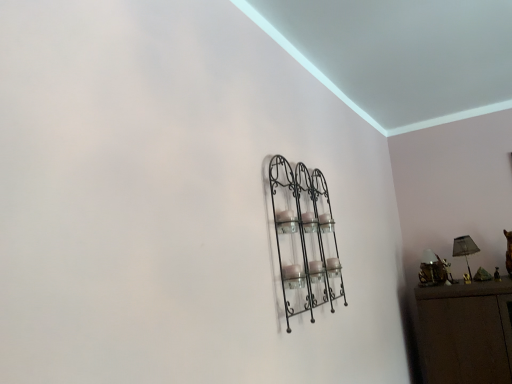
What do you see at coordinates (430, 269) in the screenshot? I see `metallic gold lamp at right` at bounding box center [430, 269].

The height and width of the screenshot is (384, 512). Find the location of `black wrought iron shelf at center`. black wrought iron shelf at center is located at coordinates [304, 238].

You are a GUI agent. You are given a task and a screenshot of the screen. Output one action in this format:
    pyautogui.click(x=<x>, y=<y>)
    Task: Click on the metallic gold lamp at right
    This screenshot has width=512, height=384.
    Given the screenshot: What is the action you would take?
    pyautogui.click(x=430, y=269)

Which is behind, black wrought iron shelf at center or metallic gold lamp at right?

metallic gold lamp at right is further from the camera.

In the scene shown: Is there a large distance between black wrought iron shelf at center and metallic gold lamp at right?

Yes, black wrought iron shelf at center is far from metallic gold lamp at right.

Does black wrought iron shelf at center have a greater height compared to metallic gold lamp at right?

Yes.

Between matte black lampshade at right and black wrought iron shelf at center, which one has smaller size?

Smaller between the two is matte black lampshade at right.

Is matte black lampshade at right to the left of black wrought iron shelf at center from the viewer's perspective?

In fact, matte black lampshade at right is to the right of black wrought iron shelf at center.

Is matte black lampshade at right not inside black wrought iron shelf at center?

Yes.

Image resolution: width=512 pixels, height=384 pixels. In order to click on shelf on the left of matte black lampshade at right in this screenshot , I will do `click(304, 238)`.

From the picture: Is matte black lampshade at right in contact with metallic gold lamp at right?

matte black lampshade at right and metallic gold lamp at right are clearly separated.

From the image's perspective, is matte black lampshade at right over metallic gold lamp at right?

Correct, matte black lampshade at right appears higher than metallic gold lamp at right in the image.

Does matte black lampshade at right lie behind metallic gold lamp at right?

No, it is not.

Considering the relative sizes of black wrought iron shelf at center and matte black lampshade at right in the image provided, is black wrought iron shelf at center shorter than matte black lampshade at right?

No, black wrought iron shelf at center is not shorter than matte black lampshade at right.

Between black wrought iron shelf at center and matte black lampshade at right, which one appears on the right side from the viewer's perspective?

matte black lampshade at right.

Is black wrought iron shelf at center facing towards matte black lampshade at right?

No.

Which point is more forward, (312, 279) or (458, 248)?

The point (312, 279) is more forward.

Considering the relative sizes of metallic gold lamp at right and black wrought iron shelf at center in the image provided, is metallic gold lamp at right shorter than black wrought iron shelf at center?

Indeed, metallic gold lamp at right has a lesser height compared to black wrought iron shelf at center.

From the picture: Which is more to the right, metallic gold lamp at right or black wrought iron shelf at center?

metallic gold lamp at right is more to the right.

From a real-world perspective, does metallic gold lamp at right sit lower than black wrought iron shelf at center?

Yes, from a real-world perspective, metallic gold lamp at right is under black wrought iron shelf at center.

From the image's perspective, does metallic gold lamp at right appear lower than black wrought iron shelf at center?

Yes, from the image's perspective, metallic gold lamp at right is beneath black wrought iron shelf at center.

Between metallic gold lamp at right and matte black lampshade at right, which one has more height?

Standing taller between the two is matte black lampshade at right.

Which object is further away from the camera taking this photo, metallic gold lamp at right or matte black lampshade at right?

metallic gold lamp at right.

Can you tell me how much metallic gold lamp at right and matte black lampshade at right differ in facing direction?

The angular difference between metallic gold lamp at right and matte black lampshade at right is 2.91 degrees.

Choose the correct answer: Is metallic gold lamp at right inside matte black lampshade at right or outside it?

The correct answer is: outside.

This screenshot has width=512, height=384. Identify the location of shelf above the metallic gold lamp at right (from the image's perspective). (304, 238).

Find the location of a particular element. shelf above the matte black lampshade at right (from a real-world perspective) is located at coordinates (304, 238).

Which object lies nearer to the anchor point matte black lampshade at right, metallic gold lamp at right or black wrought iron shelf at center?

The object closer to matte black lampshade at right is metallic gold lamp at right.

Estimate the real-world distances between objects in this image. Which object is closer to black wrought iron shelf at center, matte black lampshade at right or metallic gold lamp at right?

Among the two, metallic gold lamp at right is located nearer to black wrought iron shelf at center.

Estimate the real-world distances between objects in this image. Which object is further from matte black lampshade at right, black wrought iron shelf at center or metallic gold lamp at right?

Based on the image, black wrought iron shelf at center appears to be further to matte black lampshade at right.

Considering their positions, is metallic gold lamp at right positioned further to black wrought iron shelf at center than matte black lampshade at right?

Based on the image, matte black lampshade at right appears to be further to black wrought iron shelf at center.

Estimate the real-world distances between objects in this image. Which object is closer to metallic gold lamp at right, black wrought iron shelf at center or matte black lampshade at right?

Among the two, matte black lampshade at right is located nearer to metallic gold lamp at right.

Based on their spatial positions, is matte black lampshade at right or black wrought iron shelf at center further from metallic gold lamp at right?

black wrought iron shelf at center is positioned further to the anchor metallic gold lamp at right.

Where is `table lamp between black wrought iron shelf at center and metallic gold lamp at right from front to back`? This screenshot has height=384, width=512. table lamp between black wrought iron shelf at center and metallic gold lamp at right from front to back is located at coordinates (465, 249).